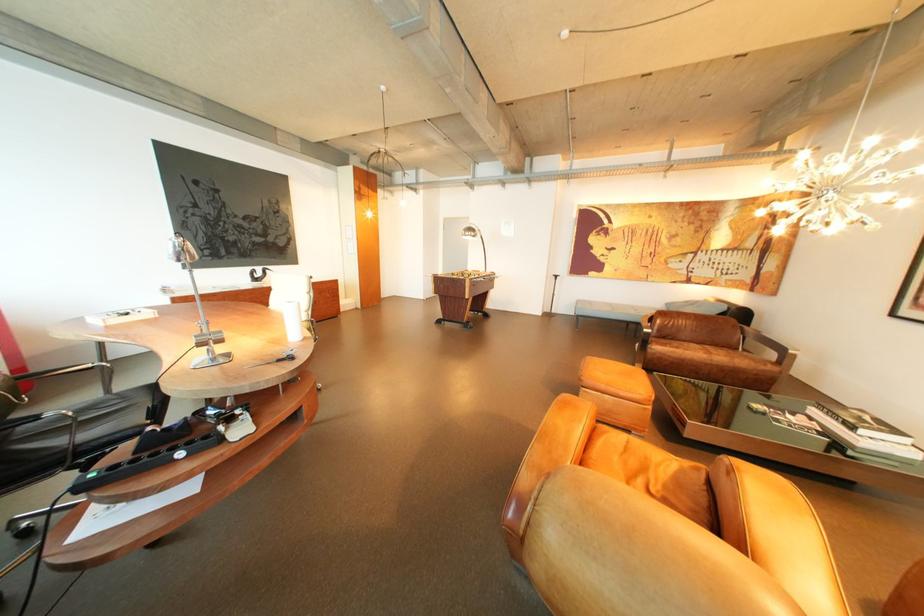
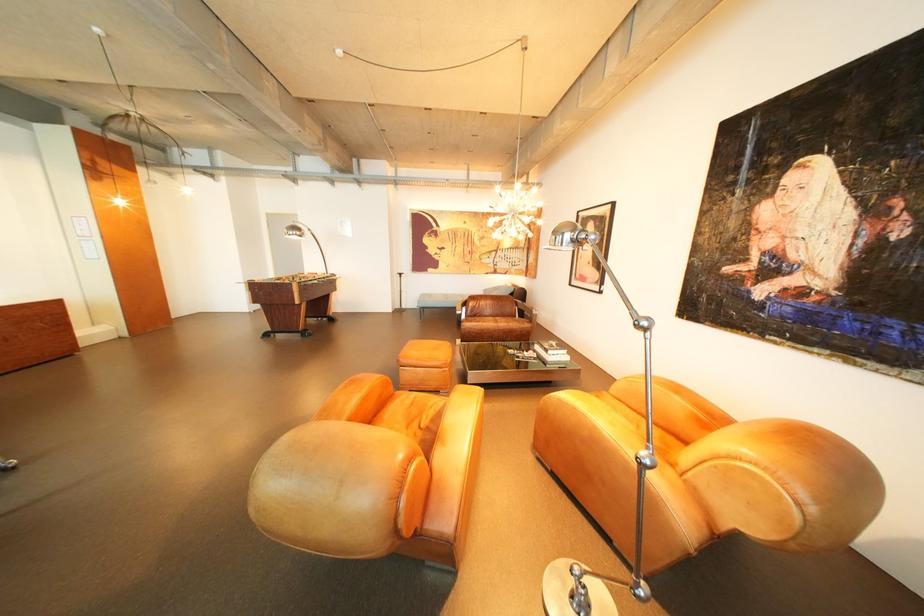
The point at [650,430] is marked in the first image. Where is the corresponding point in the second image?

(456, 390)